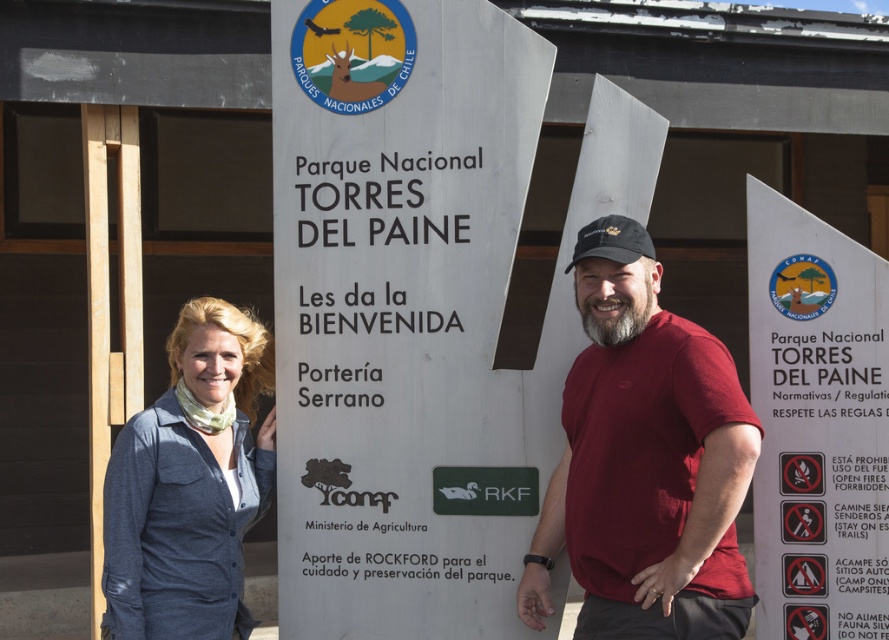
Question: Among these objects, which one is nearest to the camera?

Choices:
 (A) silver metallic sign at center
 (B) denim shirt at center

Answer: (B)

Question: Which point appears farthest from the camera in this image?

Choices:
 (A) (219, 600)
 (B) (821, 292)

Answer: (A)

Question: Is silver metallic sign at center smaller than matte red t-shirt at center?

Choices:
 (A) no
 (B) yes

Answer: (A)

Question: Does silver metallic sign at center come in front of denim shirt at center?

Choices:
 (A) yes
 (B) no

Answer: (B)

Question: Where is silver metallic sign at center located in relation to matte red t-shirt at center in the image?

Choices:
 (A) right
 (B) left

Answer: (B)

Question: Which of the following is the farthest from the observer?

Choices:
 (A) denim shirt at center
 (B) white plastic sign at right

Answer: (B)